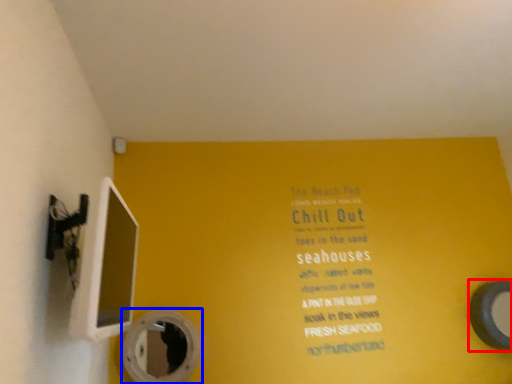
Question: Among these objects, which one is nearest to the camera, mirror (highlighted by a red box) or mirror (highlighted by a blue box)?

Choices:
 (A) mirror
 (B) mirror

Answer: (B)